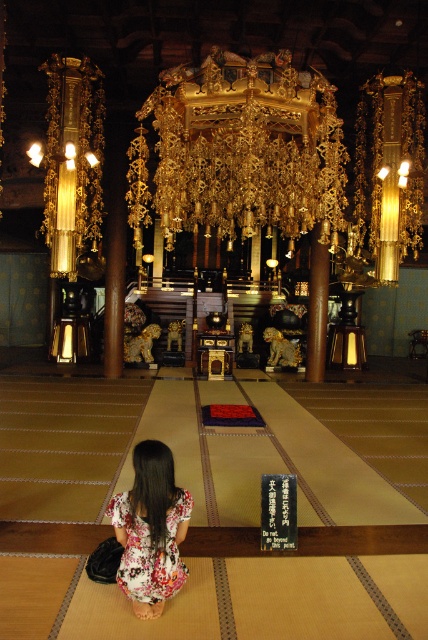
Which is behind, point (252, 81) or point (154, 481)?

The point (252, 81) is behind.

In the scene shown: Is gold metallic chandelier at center further to camera compared to floral fabric dress at lower center?

Yes, gold metallic chandelier at center is further from the viewer.

Who is more distant from viewer, (273, 60) or (169, 529)?

The point (273, 60) is behind.

Where is `gold metallic chandelier at center`? The image size is (428, 640). gold metallic chandelier at center is located at coordinates (246, 147).